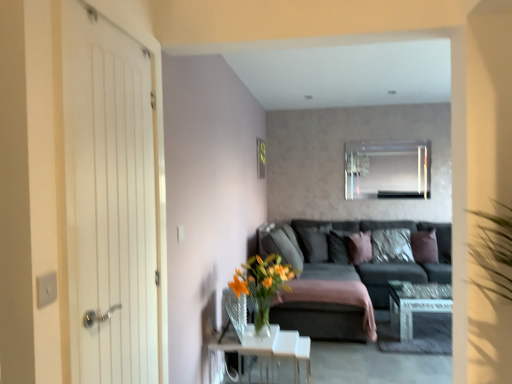
The height and width of the screenshot is (384, 512). In order to click on orange glass vase at center in this screenshot , I will do `click(262, 285)`.

The height and width of the screenshot is (384, 512). Find the location of `clear glass table at lower center, positioned as the second table in right-to-left order`. clear glass table at lower center, positioned as the second table in right-to-left order is located at coordinates (268, 351).

Find the location of a particular element. This screenshot has height=384, width=512. velvet brown pillow at center, which appears as the fifth pillow when viewed from the right is located at coordinates (315, 242).

Describe the element at coordinates (360, 247) in the screenshot. I see `pink fabric pillow at center, placed as the third pillow when sorted from right to left` at that location.

This screenshot has height=384, width=512. I want to click on orange glass vase at center, so click(x=262, y=285).

Locate an element on the screen. door located above the dark gray fabric pillow at center, the 2th pillow from the left (from the image's perspective) is located at coordinates (109, 200).

Between white wooden door at left and dark gray fabric pillow at center, the 2th pillow from the left, which one appears on the right side from the viewer's perspective?

dark gray fabric pillow at center, the 2th pillow from the left, is more to the right.

Which object is closer to the camera, white wooden door at left or dark gray fabric pillow at center, the 2th pillow from the left?

Positioned in front is white wooden door at left.

How many degrees apart are the facing directions of white wooden door at left and dark gray fabric pillow at center, placed as the 4th pillow when sorted from right to left?

90 degrees.

Between dark gray fabric pillow at center, placed as the 4th pillow when sorted from right to left, and clear glass mirror at upper center, which one has smaller size?

With smaller size is dark gray fabric pillow at center, placed as the 4th pillow when sorted from right to left.

From a real-world perspective, is dark gray fabric pillow at center, the 2th pillow from the left, physically below clear glass mirror at upper center?

Yes, from a real-world perspective, dark gray fabric pillow at center, the 2th pillow from the left, is below clear glass mirror at upper center.

Is dark gray fabric pillow at center, the 2th pillow from the left, spatially inside clear glass mirror at upper center, or outside of it?

dark gray fabric pillow at center, the 2th pillow from the left, is located beyond the bounds of clear glass mirror at upper center.

From the image's perspective, is dark gray fabric pillow at center, placed as the 4th pillow when sorted from right to left, on clear glass mirror at upper center?

No, from the image's perspective, dark gray fabric pillow at center, placed as the 4th pillow when sorted from right to left, is not on top of clear glass mirror at upper center.

Which object is closer to the camera, metallic gold picture frame at upper center or clear glass mirror at upper center?

metallic gold picture frame at upper center.

Is the surface of metallic gold picture frame at upper center in direct contact with clear glass mirror at upper center?

No, metallic gold picture frame at upper center is not in contact with clear glass mirror at upper center.

Which point is more forward, (260, 162) or (373, 146)?

The point (260, 162) is closer to the camera.

From the image's perspective, does orange glass vase at center appear higher than white wooden door at left?

No, from the image's perspective, orange glass vase at center is not on top of white wooden door at left.

Are orange glass vase at center and white wooden door at left far apart?

orange glass vase at center is positioned a significant distance from white wooden door at left.

From a real-world perspective, is orange glass vase at center physically below white wooden door at left?

Correct, in the physical world, orange glass vase at center is lower than white wooden door at left.

Is orange glass vase at center outside of white wooden door at left?

orange glass vase at center lies outside white wooden door at left's area.

From a real-world perspective, who is located higher, metallic gold picture frame at upper center or white glossy table at center, placed as the 1th table when sorted from back to front?

metallic gold picture frame at upper center.

Is there a large distance between metallic gold picture frame at upper center and white glossy table at center, placed as the 1th table when sorted from back to front?

Yes.

Does metallic gold picture frame at upper center have a greater width compared to white glossy table at center, the second table when ordered from left to right?

No, metallic gold picture frame at upper center is not wider than white glossy table at center, the second table when ordered from left to right.

This screenshot has height=384, width=512. Identify the location of the 2nd table positioned below the metallic gold picture frame at upper center (from a real-world perspective). (416, 304).

Locate an element on the screen. The width and height of the screenshot is (512, 384). the 3rd pillow counting from the left side of the white glossy table at center, placed as the 1th table when sorted from back to front is located at coordinates (315, 242).

Does white glossy table at center, which is the second table from front to back, come behind velvet brown pillow at center, which appears as the fifth pillow when viewed from the right?

No.

How far apart are white glossy table at center, which is the second table from front to back, and velvet brown pillow at center, the first pillow from the left?

white glossy table at center, which is the second table from front to back, and velvet brown pillow at center, the first pillow from the left, are 3.89 feet apart.

Does point (418, 284) appear closer or farther from the camera than point (326, 259)?

Point (418, 284) is closer to the camera than point (326, 259).

Is clear glass table at lower center, positioned as the second table in right-to-left order, positioned with its back to pink fabric pillow at center, placed as the third pillow when sorted from right to left?

No, clear glass table at lower center, positioned as the second table in right-to-left order, is not facing the opposite direction of pink fabric pillow at center, placed as the third pillow when sorted from right to left.

Considering the positions of objects clear glass table at lower center, which is the second table in back-to-front order, and pink fabric pillow at center, placed as the third pillow when sorted from right to left, in the image provided, who is more to the left, clear glass table at lower center, which is the second table in back-to-front order, or pink fabric pillow at center, placed as the third pillow when sorted from right to left,?

From the viewer's perspective, clear glass table at lower center, which is the second table in back-to-front order, appears more on the left side.

From a real-world perspective, is clear glass table at lower center, which is the second table in back-to-front order, located higher than pink fabric pillow at center, the third pillow in the left-to-right sequence?

No, from a real-world perspective, clear glass table at lower center, which is the second table in back-to-front order, is not over pink fabric pillow at center, the third pillow in the left-to-right sequence

Where is `the 2nd pillow to the right of the white wooden door at left, counting from the anchor's position`? Image resolution: width=512 pixels, height=384 pixels. the 2nd pillow to the right of the white wooden door at left, counting from the anchor's position is located at coordinates (339, 246).

Find the location of `the 2nd pillow in front of the clear glass mirror at upper center`. the 2nd pillow in front of the clear glass mirror at upper center is located at coordinates (339, 246).

Looking at the image, which one is located further to metallic gold picture frame at upper center, clear glass table at lower center, marked as the 1th table in a left-to-right arrangement, or dark gray fabric pillow at center, placed as the 4th pillow when sorted from right to left?

The object further to metallic gold picture frame at upper center is clear glass table at lower center, marked as the 1th table in a left-to-right arrangement.

Considering their positions, is clear glass table at lower center, which is the second table in back-to-front order, positioned further to white wooden door at left than orange glass vase at center?

Based on the image, orange glass vase at center appears to be further to white wooden door at left.

When comparing their distances from dark gray fabric pillow at center, the 2th pillow from the left, does dark gray fabric couch at center or clear glass table at lower center, which is the second table in back-to-front order, seem further?

The object further to dark gray fabric pillow at center, the 2th pillow from the left, is clear glass table at lower center, which is the second table in back-to-front order.

Which object lies further to the anchor point clear glass mirror at upper center, dark gray fabric couch at center or brown velvet pillow at right, the first pillow viewed from the right?

dark gray fabric couch at center.

Based on their spatial positions, is pink fabric pillow at center, the third pillow in the left-to-right sequence, or clear glass table at lower center, which is the first table in front-to-back order, closer to white glossy table at center, which appears as the first table when viewed from the right?

Based on the image, pink fabric pillow at center, the third pillow in the left-to-right sequence, appears to be nearer to white glossy table at center, which appears as the first table when viewed from the right.

When comparing their distances from brown velvet pillow at right, the 5th pillow from the left, does textured gray pillow at center, arranged as the fourth pillow when viewed from the left, or clear glass mirror at upper center seem further?

clear glass mirror at upper center is further to brown velvet pillow at right, the 5th pillow from the left.

Which object lies nearer to the anchor point white glossy table at center, placed as the 1th table when sorted from back to front, clear glass mirror at upper center or clear glass table at lower center, which is the second table in back-to-front order?

Among the two, clear glass table at lower center, which is the second table in back-to-front order, is located nearer to white glossy table at center, placed as the 1th table when sorted from back to front.

When comparing their distances from clear glass mirror at upper center, does brown velvet pillow at right, the 5th pillow from the left, or orange glass vase at center seem closer?

The object closer to clear glass mirror at upper center is brown velvet pillow at right, the 5th pillow from the left.

Find the location of `floral arrangement between clear glass table at lower center, marked as the 1th table in a left-to-right arrangement, and dark gray fabric couch at center`. floral arrangement between clear glass table at lower center, marked as the 1th table in a left-to-right arrangement, and dark gray fabric couch at center is located at coordinates (262, 285).

Where is `mirror situated between velvet brown pillow at center, the first pillow from the left, and brown velvet pillow at right, the first pillow viewed from the right, from left to right`? mirror situated between velvet brown pillow at center, the first pillow from the left, and brown velvet pillow at right, the first pillow viewed from the right, from left to right is located at coordinates (388, 169).

The width and height of the screenshot is (512, 384). I want to click on studio couch between clear glass table at lower center, positioned as the second table in right-to-left order, and dark gray fabric pillow at center, placed as the 4th pillow when sorted from right to left, in the front-back direction, so click(x=350, y=272).

Identify the location of picture frame between orange glass vase at center and clear glass mirror at upper center in the front-back direction. (261, 158).